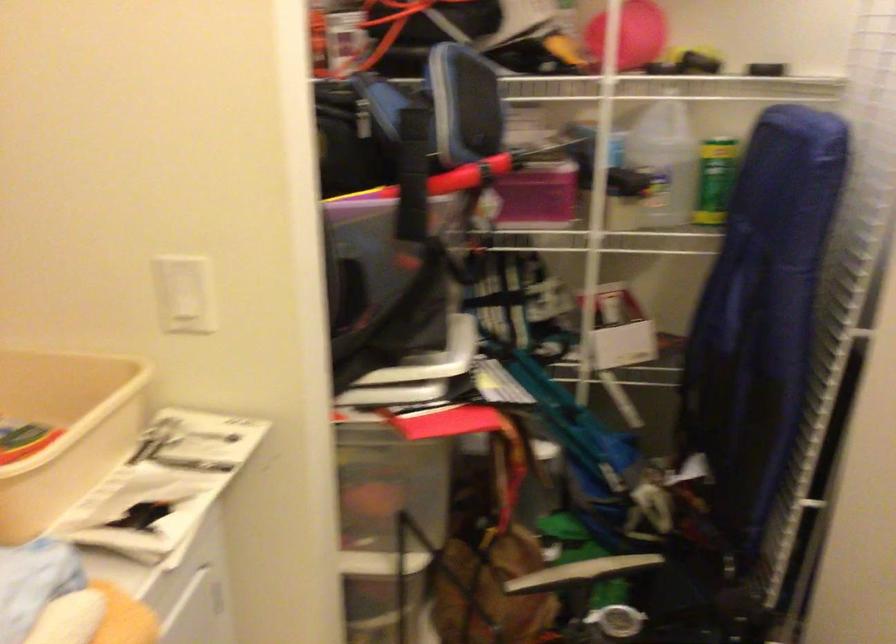
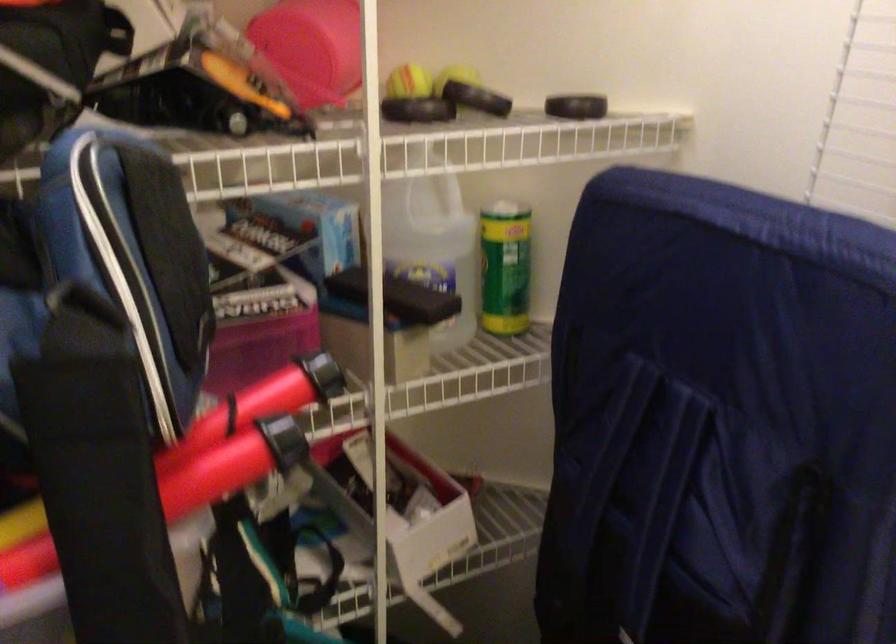
Question: The images are taken continuously from a first-person perspective. In which direction is your viewpoint rotating?

Choices:
 (A) Left
 (B) Right
 (C) Up
 (D) Down

Answer: (B)